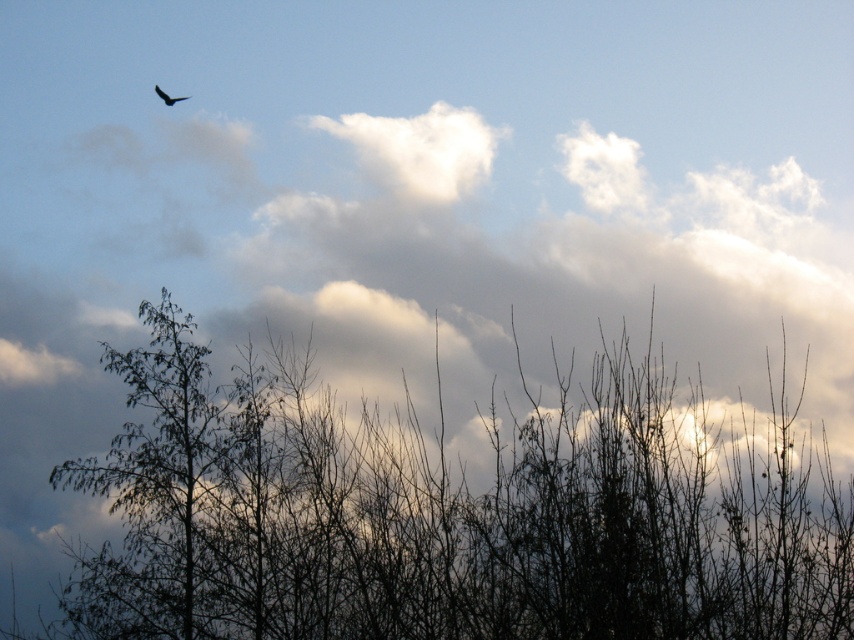
You are an ornithologist observing the dark brown feathered bird at upper left and the silhouette bare branches at center. If the bird wants to land on the branches, would its wingspan allow it to fit between the branches without touching them?

The silhouette bare branches at center might be wider than dark brown feathered bird at upper left, so the bird might have enough space to land without touching the branches if its wingspan is narrower than the branches width.

Consider the image. You are an astronomer observing the night sky and notice a bright star at point (445,513). According to the scene description, where exactly is this star located?

The bright star at point (445,513) is located on the silhouette bare branches at center, as indicated by the objects description.

You are an ornithologist observing the dark brown feathered bird at upper left and the silhouette bare branches at center. From your position, which object is closer to you?

The silhouette bare branches at center is closer to you because it is in front of the dark brown feathered bird at upper left.